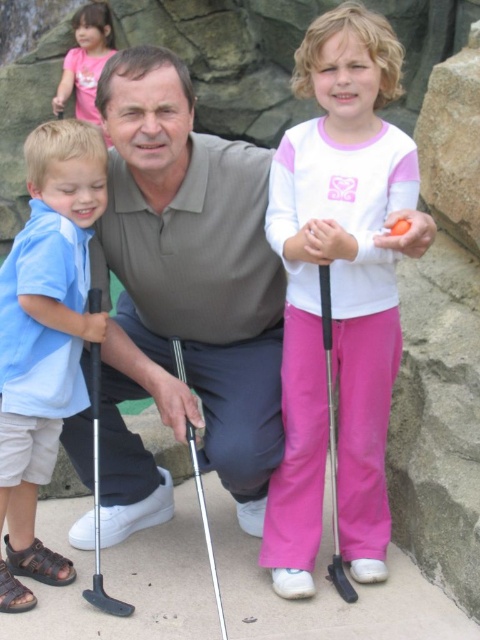
Question: Considering the relative positions of matte gray polo shirt at center and blue cotton shirt at left in the image provided, where is matte gray polo shirt at center located with respect to blue cotton shirt at left?

Choices:
 (A) below
 (B) above

Answer: (B)

Question: Among these points, which one is farthest from the camera?

Choices:
 (A) (99, 596)
 (B) (76, 237)
 (C) (154, 227)

Answer: (C)

Question: Based on their relative distances, which object is farther from the black plastic golf club at lower center?

Choices:
 (A) white matte golf club at center
 (B) black plastic golf club at left
 (C) pink cotton shirt at upper left
 (D) polished silver golf club at center

Answer: (C)

Question: Does black plastic golf club at left have a lesser width compared to black plastic golf club at lower center?

Choices:
 (A) no
 (B) yes

Answer: (A)

Question: Which point is closer to the camera taking this photo?

Choices:
 (A) (240, 177)
 (B) (331, 365)
 (C) (218, 596)
 (D) (94, 392)

Answer: (C)

Question: Can you confirm if white matte golf club at center is thinner than black plastic golf club at left?

Choices:
 (A) no
 (B) yes

Answer: (A)